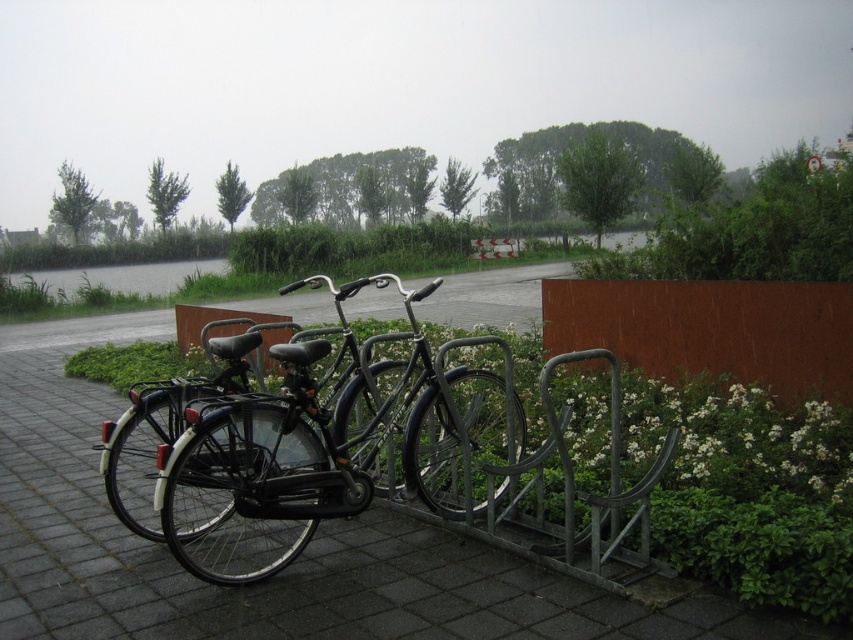
Question: Estimate the real-world distances between objects in this image. Which object is farther from the rusty metal fence at center right?

Choices:
 (A) shiny black bicycle at center
 (B) metallic gray pavement at center

Answer: (B)

Question: Which object appears farthest from the camera in this image?

Choices:
 (A) rusty metal fence at center right
 (B) shiny black bicycle at center
 (C) metallic gray pavement at center

Answer: (A)

Question: Does metallic gray pavement at center have a smaller size compared to rusty metal fence at center right?

Choices:
 (A) no
 (B) yes

Answer: (A)

Question: Can you confirm if metallic gray pavement at center is positioned to the right of shiny black bicycle at center?

Choices:
 (A) yes
 (B) no

Answer: (B)

Question: Is shiny black bicycle at center below rusty metal fence at center right?

Choices:
 (A) yes
 (B) no

Answer: (B)

Question: Which is farther from the metallic gray pavement at center?

Choices:
 (A) shiny black bicycle at center
 (B) rusty metal fence at center right

Answer: (B)